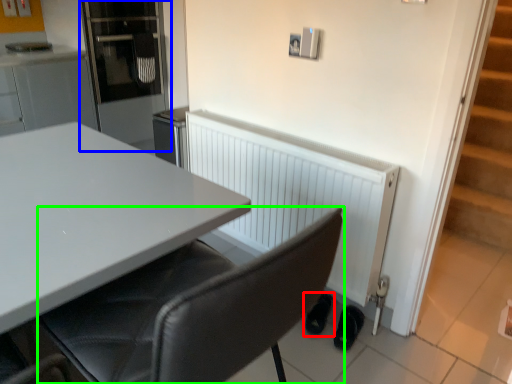
Question: Which is nearer to the footwear (highlighted by a red box)? appliance (highlighted by a blue box) or chair (highlighted by a green box).

Choices:
 (A) appliance
 (B) chair

Answer: (B)